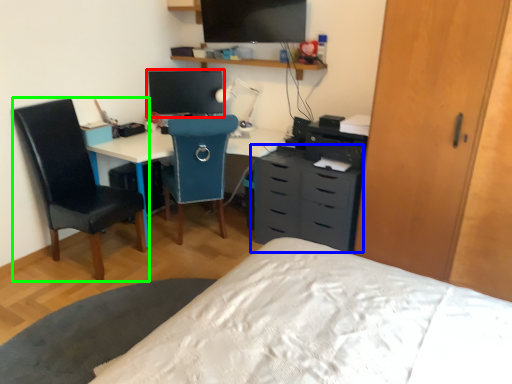
Question: Which object is positioned farthest from computer monitor (highlighted by a red box)? Select from chest of drawers (highlighted by a blue box) and chair (highlighted by a green box).

Choices:
 (A) chest of drawers
 (B) chair

Answer: (A)